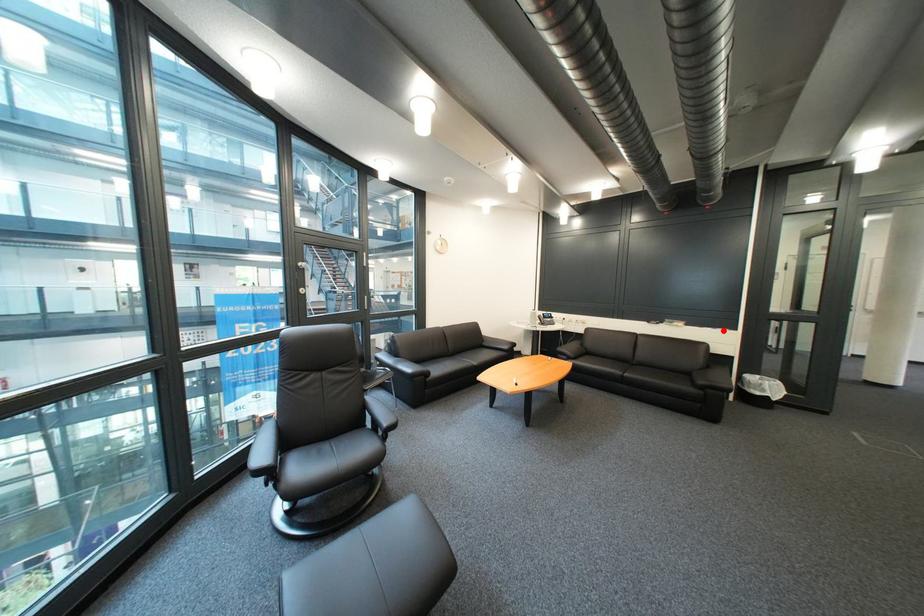
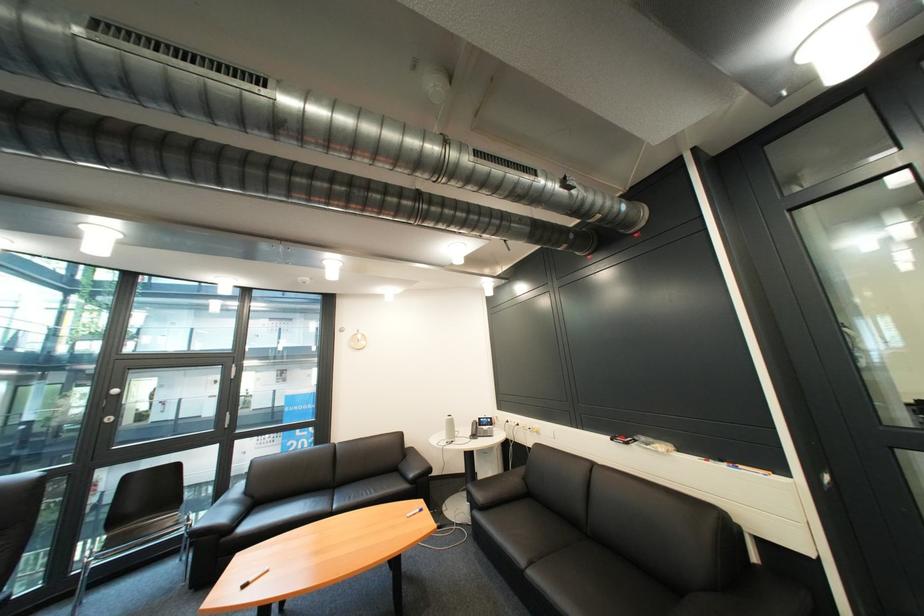
The point at the highlighted location is marked in the first image. Where is the corresponding point in the second image?

(736, 468)